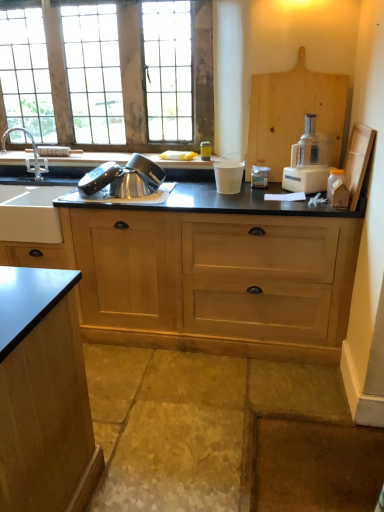
Where is `free point above metallic silver colander at sink (from a real-world perspective)`? free point above metallic silver colander at sink (from a real-world perspective) is located at coordinates (121, 167).